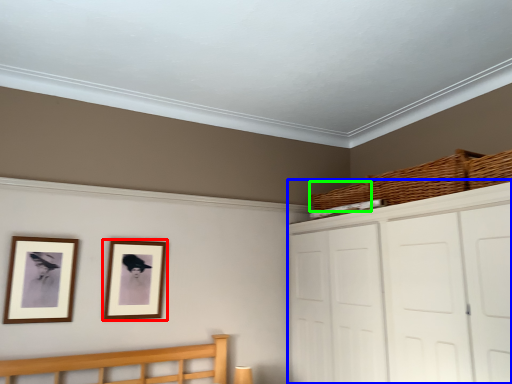
Question: Based on their relative distances, which object is nearer to picture frame (highlighted by a red box)? Choose from dresser (highlighted by a blue box) and basket (highlighted by a green box).

Choices:
 (A) dresser
 (B) basket

Answer: (A)